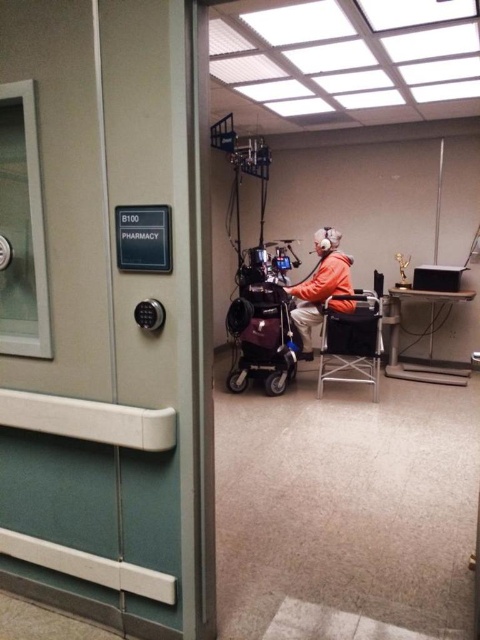
You are a maintenance worker in the hospital. You need to place a new equipment box at the exact center of the room. Where should you place it in relation to the metallic folding chair at center?

The metallic folding chair at center is already located at the exact center of the room, so placing the equipment box there would require moving the chair first.

In the scene shown: You are a technician trying to adjust the camera mounted on the cart in the pharmacy area. You need to focus on a specific point. Which of the two points, point [358,349] or point [308,289], is closer to the camera lens?

Point [358,349] is closer to the camera lens than point [308,289].

You are a maintenance worker in the hospital and need to place a new oxygen tank in the center of the room. There is a metallic folding chair at center and an orange fleece jacket at center in the way. Which object must you move first to clear the space?

The metallic folding chair at center must be moved first because it is wider than the orange fleece jacket at center, making it the larger obstacle in the center of the room.